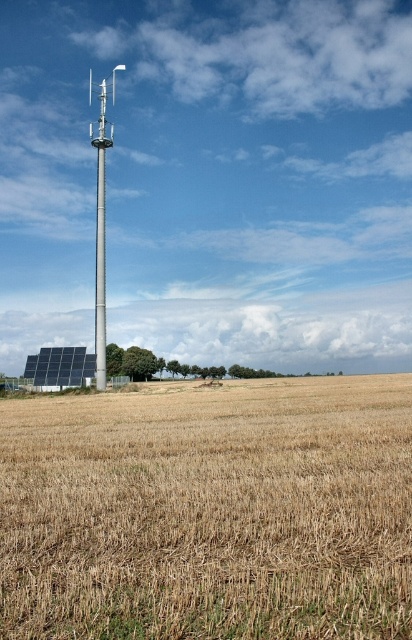
Is brown dry grass at lower center shorter than metallic pole at center?

Indeed, brown dry grass at lower center has a lesser height compared to metallic pole at center.

Based on the photo, who is lower down, brown dry grass at lower center or metallic pole at center?

brown dry grass at lower center

Identify the location of brown dry grass at lower center. The image size is (412, 640). click(208, 513).

Who is higher up, black textured solar panel at lower left or metallic pole at center?

Positioned higher is metallic pole at center.

Is black textured solar panel at lower left further to camera compared to metallic pole at center?

Yes, it is behind metallic pole at center.

Is point (79, 355) more distant than point (103, 307)?

That is True.

Locate an element on the screen. Image resolution: width=412 pixels, height=640 pixels. black textured solar panel at lower left is located at coordinates (60, 368).

Looking at this image, is the position of silver metallic tower at center more distant than that of metallic pole at center?

Answer: Yes, it is.

Can you confirm if silver metallic tower at center is positioned below metallic pole at center?

No, silver metallic tower at center is not below metallic pole at center.

This screenshot has height=640, width=412. What do you see at coordinates (100, 228) in the screenshot? I see `silver metallic tower at center` at bounding box center [100, 228].

Locate an element on the screen. This screenshot has width=412, height=640. silver metallic tower at center is located at coordinates (100, 228).